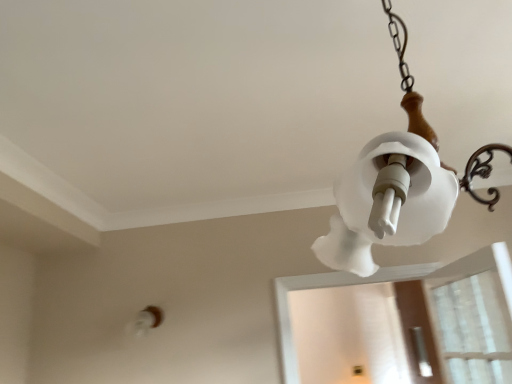
Question: Is point (154, 306) positioned closer to the camera than point (393, 210)?

Choices:
 (A) farther
 (B) closer

Answer: (A)

Question: Is white frosted glass light fixture at lower left in front of or behind white frosted glass lampshade at upper right in the image?

Choices:
 (A) front
 (B) behind

Answer: (B)

Question: Estimate the real-world distances between objects in this image. Which object is closer to the white frosted glass light fixture at lower left?

Choices:
 (A) white frosted glass lampshade at upper right
 (B) transparent plastic screen door at lower right

Answer: (B)

Question: Considering the real-world distances, which object is closest to the white frosted glass lampshade at upper right?

Choices:
 (A) white frosted glass light fixture at lower left
 (B) transparent plastic screen door at lower right

Answer: (A)